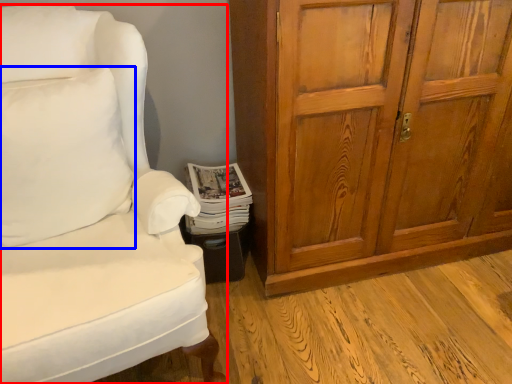
Question: Which object appears closest to the camera in this image, chair (highlighted by a red box) or pillow (highlighted by a blue box)?

Choices:
 (A) chair
 (B) pillow

Answer: (A)